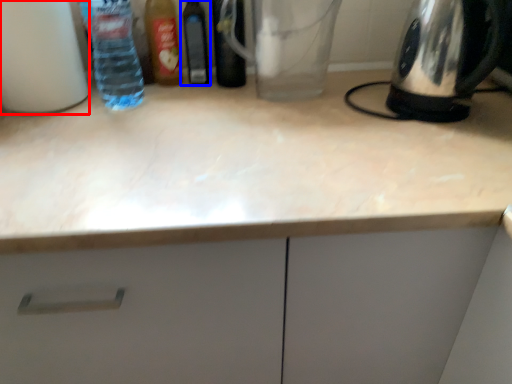
Question: Which object is closer to the camera taking this photo, bottle (highlighted by a red box) or bottle (highlighted by a blue box)?

Choices:
 (A) bottle
 (B) bottle

Answer: (A)